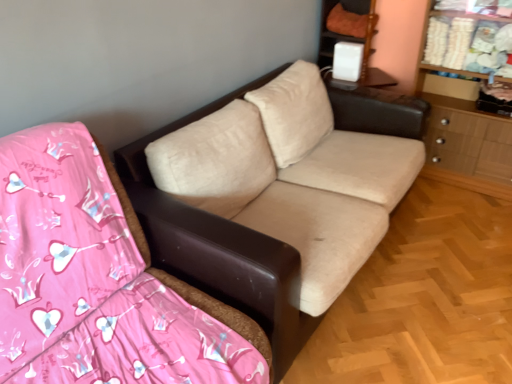
Question: In the image, is white plastic speaker at upper right positioned in front of or behind wooden dresser at right?

Choices:
 (A) behind
 (B) front

Answer: (A)

Question: In terms of size, does white plastic speaker at upper right appear bigger or smaller than wooden dresser at right?

Choices:
 (A) big
 (B) small

Answer: (B)

Question: Estimate the real-world distances between objects in this image. Which object is farther from the white plastic speaker at upper right?

Choices:
 (A) beige fabric couch at center
 (B) wooden dresser at right

Answer: (A)

Question: Estimate the real-world distances between objects in this image. Which object is closer to the wooden dresser at right?

Choices:
 (A) beige fabric couch at center
 (B) white plastic speaker at upper right

Answer: (B)